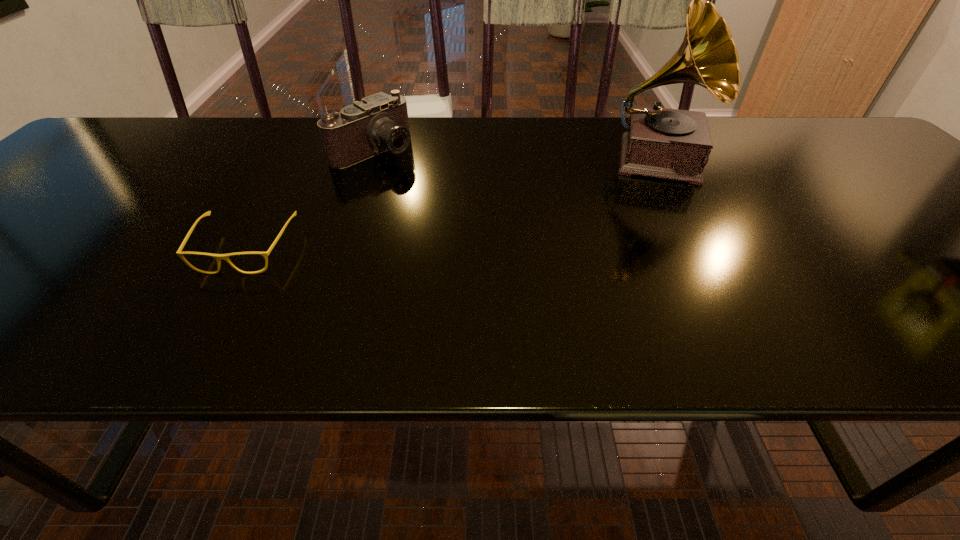
Locate an element on the screen. The width and height of the screenshot is (960, 540). free space located from the horn of the tallest object is located at coordinates (671, 295).

Locate an element on the screen. vacant region located from the horn of the tallest object is located at coordinates point(668,248).

The image size is (960, 540). I want to click on camera positioned at the far edge, so click(x=364, y=129).

The height and width of the screenshot is (540, 960). In order to click on phonograph record at the far edge in this screenshot , I will do `click(674, 144)`.

You are a GUI agent. You are given a task and a screenshot of the screen. Output one action in this format:
    pyautogui.click(x=<x>, y=<y>)
    Task: Click on the object that is positioned at the near edge
    
    Given the screenshot: What is the action you would take?
    pyautogui.click(x=218, y=257)

The height and width of the screenshot is (540, 960). Identify the location of vacant region at the far edge of the desktop. (592, 124).

Identify the location of blank area at the near edge. The image size is (960, 540). (519, 285).

Find the location of a particular element. The width and height of the screenshot is (960, 540). vacant point at the left edge is located at coordinates (11, 238).

This screenshot has height=540, width=960. In order to click on vacant space at the right edge of the desktop in this screenshot , I will do `click(889, 202)`.

This screenshot has width=960, height=540. In order to click on vacant space at the far left corner of the desktop in this screenshot , I will do `click(145, 144)`.